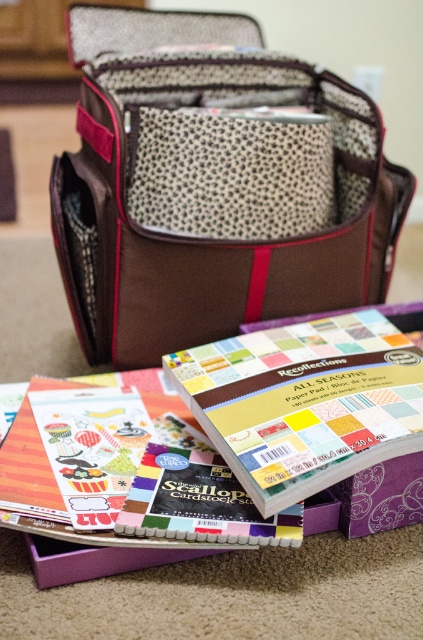
Is brown fabric bag at center smaller than matte paper pad at lower center?

Actually, brown fabric bag at center might be larger than matte paper pad at lower center.

Which of these two, brown fabric bag at center or matte paper pad at lower center, stands shorter?

matte paper pad at lower center is shorter.

Describe the element at coordinates (213, 184) in the screenshot. I see `brown fabric bag at center` at that location.

Where is `brown fabric bag at center`? The height and width of the screenshot is (640, 423). brown fabric bag at center is located at coordinates (213, 184).

Based on the photo, who is more distant from viewer, (107, 352) or (387, 490)?

Point (107, 352)

Looking at this image, is brown fabric bag at center bigger than purple cardboard box at lower center?

Correct, brown fabric bag at center is larger in size than purple cardboard box at lower center.

Locate an element on the screen. brown fabric bag at center is located at coordinates (213, 184).

Can you confirm if matte paper pad at lower center is shorter than purple cardboard box at lower center?

Yes.

Does matte paper pad at lower center have a lesser width compared to purple cardboard box at lower center?

Correct, matte paper pad at lower center's width is less than purple cardboard box at lower center's.

The width and height of the screenshot is (423, 640). I want to click on matte paper pad at lower center, so click(x=305, y=401).